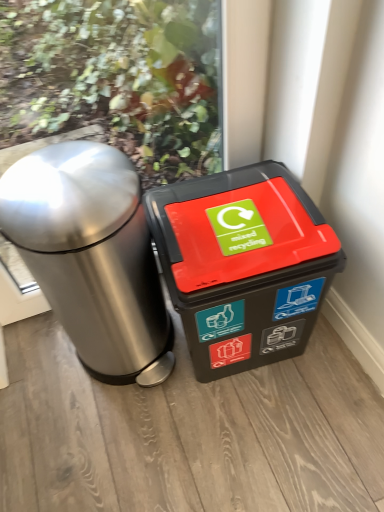
You are a GUI agent. You are given a task and a screenshot of the screen. Output one action in this format:
    pyautogui.click(x=<x>, y=<y>)
    Task: Click on the vacant region to the left of brushed metal trash can at left, acting as the 1th waste container starting from the left
    
    Given the screenshot: What is the action you would take?
    pyautogui.click(x=41, y=375)